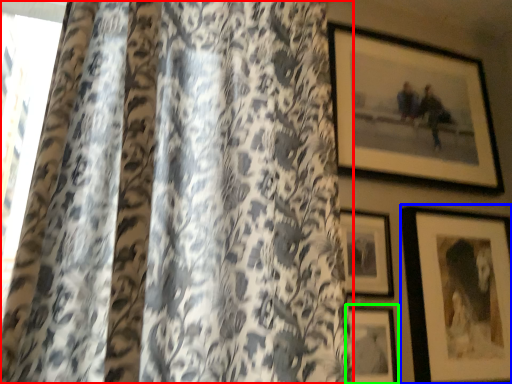
Question: Which is nearer to the curtain (highlighted by a red box)? picture frame (highlighted by a blue box) or picture frame (highlighted by a green box).

Choices:
 (A) picture frame
 (B) picture frame

Answer: (B)